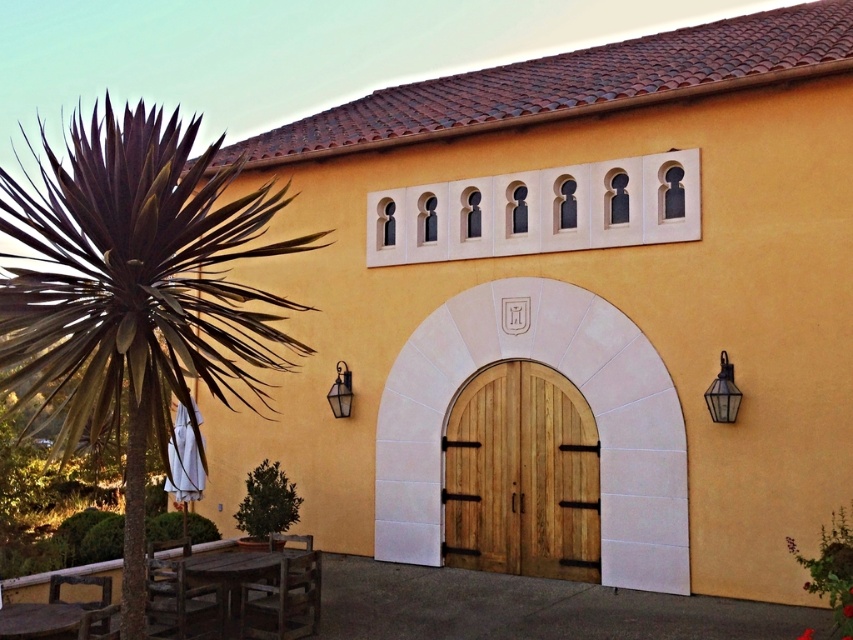
Question: Does purple-leaved palm at left come behind wooden door at center?

Choices:
 (A) no
 (B) yes

Answer: (A)

Question: Which point is farther to the camera?

Choices:
 (A) wooden door at center
 (B) purple-leaved palm at left

Answer: (A)

Question: Which object is closer to the camera taking this photo?

Choices:
 (A) purple-leaved palm at left
 (B) wooden door at center

Answer: (A)

Question: Is purple-leaved palm at left closer to camera compared to wooden door at center?

Choices:
 (A) yes
 (B) no

Answer: (A)

Question: Does purple-leaved palm at left appear on the left side of wooden door at center?

Choices:
 (A) no
 (B) yes

Answer: (B)